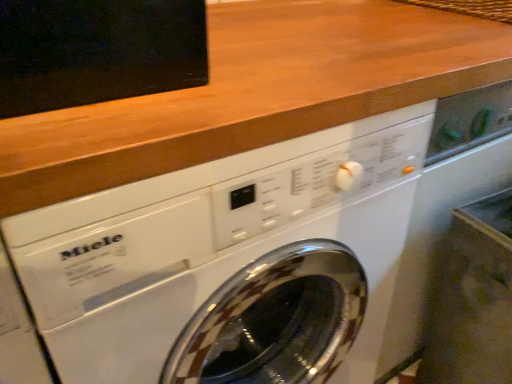
Question: Is point (367, 122) positioned closer to the camera than point (221, 21)?

Choices:
 (A) farther
 (B) closer

Answer: (B)

Question: Relative to wooden at upper center, is white glossy washing machine at center in front or behind?

Choices:
 (A) behind
 (B) front

Answer: (A)

Question: Do you think white glossy washing machine at center is within wooden at upper center, or outside of it?

Choices:
 (A) inside
 (B) outside

Answer: (B)

Question: Considering the positions of wooden at upper center and white glossy washing machine at center in the image, is wooden at upper center wider or thinner than white glossy washing machine at center?

Choices:
 (A) wide
 (B) thin

Answer: (B)

Question: Do you think wooden at upper center is within white glossy washing machine at center, or outside of it?

Choices:
 (A) inside
 (B) outside

Answer: (B)

Question: Based on their sizes in the image, would you say wooden at upper center is bigger or smaller than white glossy washing machine at center?

Choices:
 (A) big
 (B) small

Answer: (B)

Question: From the image's perspective, is wooden at upper center positioned above or below white glossy washing machine at center?

Choices:
 (A) above
 (B) below

Answer: (A)